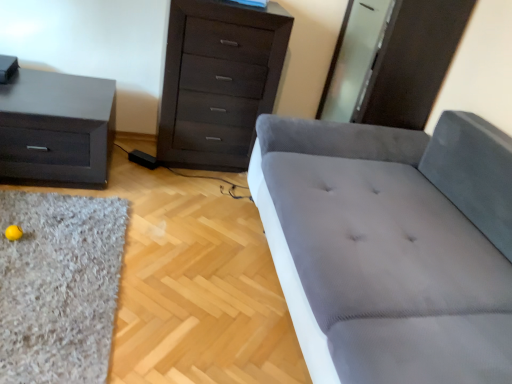
Question: Is gray fabric studio couch at center aimed at dark wood chest of drawers at upper center?

Choices:
 (A) yes
 (B) no

Answer: (B)

Question: Is gray fabric studio couch at center outside dark wood chest of drawers at upper center?

Choices:
 (A) yes
 (B) no

Answer: (A)

Question: Is gray fabric studio couch at center shorter than dark wood chest of drawers at upper center?

Choices:
 (A) no
 (B) yes

Answer: (B)

Question: Is gray fabric studio couch at center thinner than dark wood chest of drawers at upper center?

Choices:
 (A) no
 (B) yes

Answer: (A)

Question: Is gray fabric studio couch at center turned away from dark wood chest of drawers at upper center?

Choices:
 (A) no
 (B) yes

Answer: (A)

Question: Based on their positions, is gray fabric studio couch at center located to the left or right of dark wood chest of drawers at upper center?

Choices:
 (A) right
 (B) left

Answer: (A)

Question: In terms of size, does gray fabric studio couch at center appear bigger or smaller than dark wood chest of drawers at upper center?

Choices:
 (A) big
 (B) small

Answer: (A)

Question: Is point (453, 304) positioned closer to the camera than point (172, 142)?

Choices:
 (A) farther
 (B) closer

Answer: (B)

Question: From a real-world perspective, relative to dark wood chest of drawers at upper center, is gray fabric studio couch at center vertically above or below?

Choices:
 (A) above
 (B) below

Answer: (B)

Question: Is matte black nightstand at left taller or shorter than dark wood chest of drawers at upper center?

Choices:
 (A) tall
 (B) short

Answer: (B)

Question: Considering the relative positions of matte black nightstand at left and dark wood chest of drawers at upper center in the image provided, is matte black nightstand at left to the left or to the right of dark wood chest of drawers at upper center?

Choices:
 (A) right
 (B) left

Answer: (B)

Question: Considering the positions of matte black nightstand at left and dark wood chest of drawers at upper center in the image, is matte black nightstand at left wider or thinner than dark wood chest of drawers at upper center?

Choices:
 (A) thin
 (B) wide

Answer: (B)

Question: From a real-world perspective, is matte black nightstand at left physically located above or below dark wood chest of drawers at upper center?

Choices:
 (A) above
 (B) below

Answer: (B)

Question: Looking at the image, does matte black nightstand at left seem bigger or smaller compared to shaggy gray rug at lower left?

Choices:
 (A) big
 (B) small

Answer: (A)

Question: Choose the correct answer: Is matte black nightstand at left inside shaggy gray rug at lower left or outside it?

Choices:
 (A) inside
 (B) outside

Answer: (B)